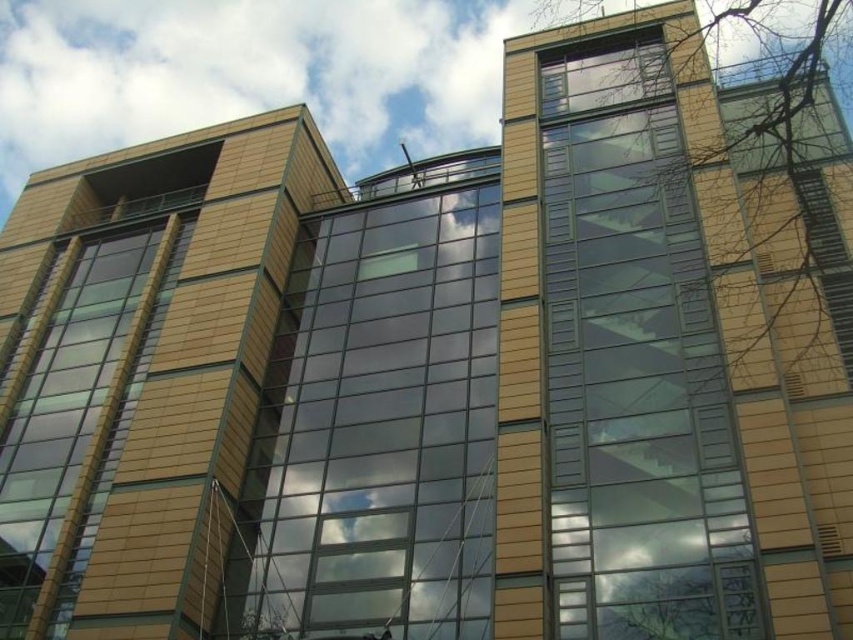
You are an architect reviewing the building design. You notice two transparent glass windows in the facade. Which one, the transparent glass window at upper right or the transparent glass window at center, is closer to the front of the building?

The transparent glass window at upper right is closer to the front of the building than the transparent glass window at center because it is in front of it.

You are an architect designing a new building and want to ensure proper ventilation. You have two transparent glass windows available for placement. The transparent glass window at upper right and the transparent glass window at center. Which window should you choose to install if you need a taller window for better airflow?

The transparent glass window at upper right is taller than the transparent glass window at center, so you should choose the transparent glass window at upper right for better airflow due to its increased height.

You are an architect analyzing the building facade. You need to determine the spatial relationship between the transparent glass window at center and the matte glass window at left. Which window is located to the right of the other?

The transparent glass window at center is positioned on the right side of matte glass window at left, meaning the transparent glass window at center is to the right of the matte glass window at left.